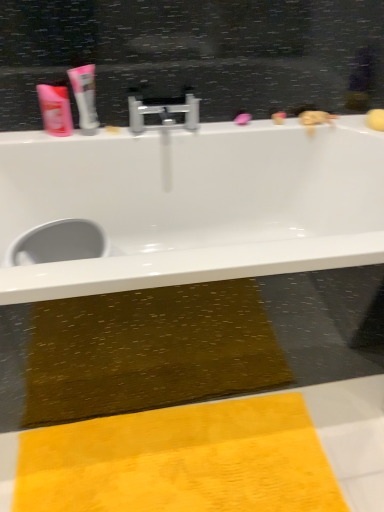
Question: Is yellow textured towel at lower center aimed at white glossy tube at upper left?

Choices:
 (A) no
 (B) yes

Answer: (A)

Question: Considering the relative sizes of yellow textured towel at lower center and white glossy tube at upper left in the image provided, is yellow textured towel at lower center bigger than white glossy tube at upper left?

Choices:
 (A) yes
 (B) no

Answer: (A)

Question: Can you confirm if yellow textured towel at lower center is taller than white glossy tube at upper left?

Choices:
 (A) yes
 (B) no

Answer: (B)

Question: From a real-world perspective, is yellow textured towel at lower center on top of white glossy tube at upper left?

Choices:
 (A) yes
 (B) no

Answer: (B)

Question: Considering the relative positions of yellow textured towel at lower center and white glossy tube at upper left in the image provided, is yellow textured towel at lower center in front of white glossy tube at upper left?

Choices:
 (A) no
 (B) yes

Answer: (B)

Question: Is white glossy bathtub at upper center situated inside silver metallic faucet at center or outside?

Choices:
 (A) inside
 (B) outside

Answer: (B)

Question: In terms of width, does white glossy bathtub at upper center look wider or thinner when compared to silver metallic faucet at center?

Choices:
 (A) thin
 (B) wide

Answer: (B)

Question: Based on their sizes in the image, would you say white glossy bathtub at upper center is bigger or smaller than silver metallic faucet at center?

Choices:
 (A) small
 (B) big

Answer: (B)

Question: Is point (24, 212) closer or farther from the camera than point (148, 105)?

Choices:
 (A) farther
 (B) closer

Answer: (A)

Question: Relative to pink plastic shampoo at upper left, is silver metallic faucet at center in front or behind?

Choices:
 (A) front
 (B) behind

Answer: (B)

Question: Considering the positions of silver metallic faucet at center and pink plastic shampoo at upper left in the image, is silver metallic faucet at center bigger or smaller than pink plastic shampoo at upper left?

Choices:
 (A) small
 (B) big

Answer: (B)

Question: From their relative heights in the image, would you say silver metallic faucet at center is taller or shorter than pink plastic shampoo at upper left?

Choices:
 (A) short
 (B) tall

Answer: (A)

Question: From a real-world perspective, is silver metallic faucet at center positioned above or below pink plastic shampoo at upper left?

Choices:
 (A) below
 (B) above

Answer: (A)

Question: From the image's perspective, is pink plastic shampoo at upper left above or below silver metallic faucet at center?

Choices:
 (A) above
 (B) below

Answer: (B)

Question: Considering their positions, is pink plastic shampoo at upper left located in front of or behind silver metallic faucet at center?

Choices:
 (A) behind
 (B) front

Answer: (B)